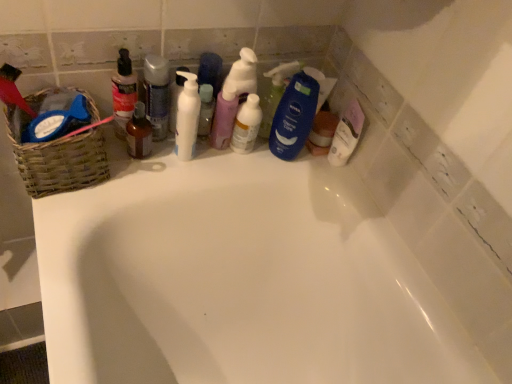
Image resolution: width=512 pixels, height=384 pixels. I want to click on empty space that is to the right of woven brown basket at left, so click(x=141, y=175).